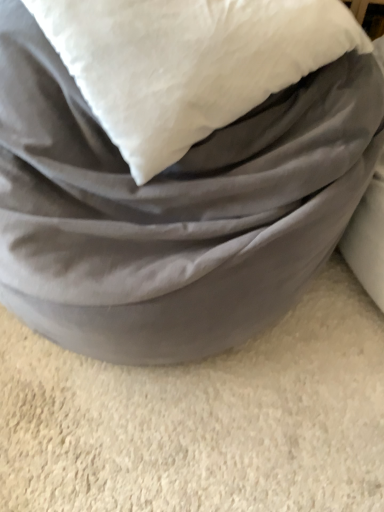
Measure the distance between point (233, 67) and camera.

Point (233, 67) is 24.17 inches away from camera.

This screenshot has width=384, height=512. What do you see at coordinates (188, 63) in the screenshot?
I see `white soft pillow at upper center` at bounding box center [188, 63].

This screenshot has height=512, width=384. I want to click on white soft pillow at upper center, so click(188, 63).

Identify the location of matte gray bean bag at center. (172, 208).

Describe the element at coordinates (172, 208) in the screenshot. This screenshot has width=384, height=512. I see `matte gray bean bag at center` at that location.

Image resolution: width=384 pixels, height=512 pixels. Identify the location of white soft pillow at upper center. (188, 63).

Based on the photo, considering the relative positions of white soft pillow at upper center and matte gray bean bag at center in the image provided, is white soft pillow at upper center to the right of matte gray bean bag at center from the viewer's perspective?

Yes.

Which object is further away from the camera taking this photo, white soft pillow at upper center or matte gray bean bag at center?

white soft pillow at upper center is more distant.

Does point (202, 105) come farther from viewer compared to point (94, 162)?

No, (202, 105) is in front of (94, 162).

From the image's perspective, is white soft pillow at upper center above matte gray bean bag at center?

Yes.

From a real-world perspective, which object rests below the other?

From a 3D spatial view, matte gray bean bag at center is below.

Can you confirm if white soft pillow at upper center is thinner than matte gray bean bag at center?

Yes, white soft pillow at upper center is thinner than matte gray bean bag at center.

Consider the image. Which of these two, white soft pillow at upper center or matte gray bean bag at center, stands shorter?

white soft pillow at upper center.

Who is bigger, white soft pillow at upper center or matte gray bean bag at center?

matte gray bean bag at center is bigger.

Is matte gray bean bag at center surrounded by white soft pillow at upper center?

No, matte gray bean bag at center is not inside white soft pillow at upper center.

Is white soft pillow at upper center with matte gray bean bag at center?

They are not placed beside each other.

Could you tell me if white soft pillow at upper center is facing matte gray bean bag at center?

Yes, white soft pillow at upper center is oriented towards matte gray bean bag at center.

The image size is (384, 512). I want to click on pillow on the right of matte gray bean bag at center, so click(188, 63).

Does matte gray bean bag at center appear on the right side of white soft pillow at upper center?

No.

Is matte gray bean bag at center positioned behind white soft pillow at upper center?

No, matte gray bean bag at center is closer to the camera.

Which is further, (215,172) or (245,11)?

The point (215,172) is more distant.

From the image's perspective, is matte gray bean bag at center on white soft pillow at upper center?

Incorrect, from the image's perspective, matte gray bean bag at center is lower than white soft pillow at upper center.

From a real-world perspective, is matte gray bean bag at center positioned above or below white soft pillow at upper center?

In terms of real-world spatial position, matte gray bean bag at center is below white soft pillow at upper center.

Considering the sizes of objects matte gray bean bag at center and white soft pillow at upper center in the image provided, who is wider, matte gray bean bag at center or white soft pillow at upper center?

matte gray bean bag at center is wider.

Between matte gray bean bag at center and white soft pillow at upper center, which one has more height?

Standing taller between the two is matte gray bean bag at center.

Can you confirm if matte gray bean bag at center is smaller than white soft pillow at upper center?

Incorrect, matte gray bean bag at center is not smaller in size than white soft pillow at upper center.

Is white soft pillow at upper center surrounded by matte gray bean bag at center?

Yes, matte gray bean bag at center contains white soft pillow at upper center.

Does matte gray bean bag at center touch white soft pillow at upper center?

No, matte gray bean bag at center is not making contact with white soft pillow at upper center.

Could you tell me if matte gray bean bag at center is facing white soft pillow at upper center?

No, matte gray bean bag at center is not facing towards white soft pillow at upper center.

Can you tell me how much matte gray bean bag at center and white soft pillow at upper center differ in facing direction?

The facing directions of matte gray bean bag at center and white soft pillow at upper center are 44.1 degrees apart.

Find the location of a particular element. furniture that is on the left side of white soft pillow at upper center is located at coordinates (172, 208).

The image size is (384, 512). Find the location of `pillow that appears behind the matte gray bean bag at center`. pillow that appears behind the matte gray bean bag at center is located at coordinates (188, 63).

Where is `pillow above the matte gray bean bag at center (from a real-world perspective)`? pillow above the matte gray bean bag at center (from a real-world perspective) is located at coordinates (188, 63).